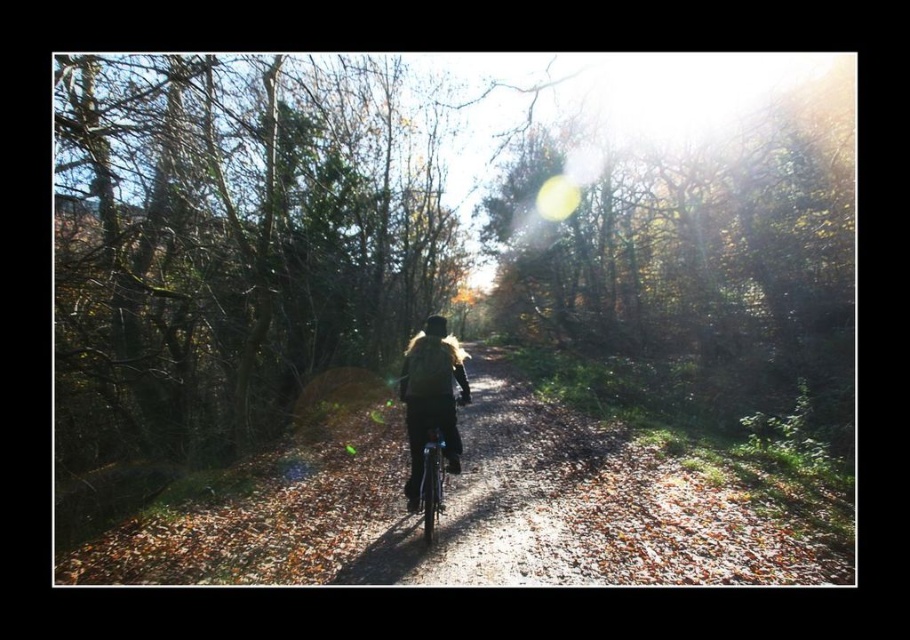
Question: Does matte black bicycle at center appear over black matte helmet at center?

Choices:
 (A) no
 (B) yes

Answer: (A)

Question: Is matte black bicycle at center positioned in front of black matte helmet at center?

Choices:
 (A) yes
 (B) no

Answer: (A)

Question: Which object is closer to the camera taking this photo?

Choices:
 (A) matte black bicycle at center
 (B) fuzzy black jacket at center
 (C) black matte helmet at center

Answer: (A)

Question: Is matte black bicycle at center to the left of black matte helmet at center from the viewer's perspective?

Choices:
 (A) yes
 (B) no

Answer: (B)

Question: Which is farther from the matte black bicycle at center?

Choices:
 (A) fuzzy black jacket at center
 (B) black matte helmet at center

Answer: (A)

Question: Which of the following is the closest to the observer?

Choices:
 (A) (432, 324)
 (B) (422, 554)

Answer: (B)